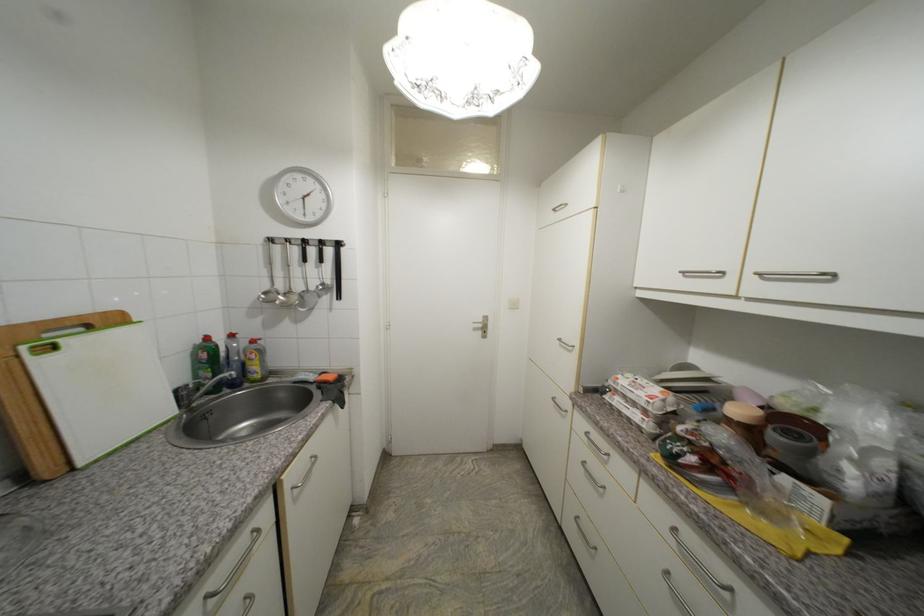
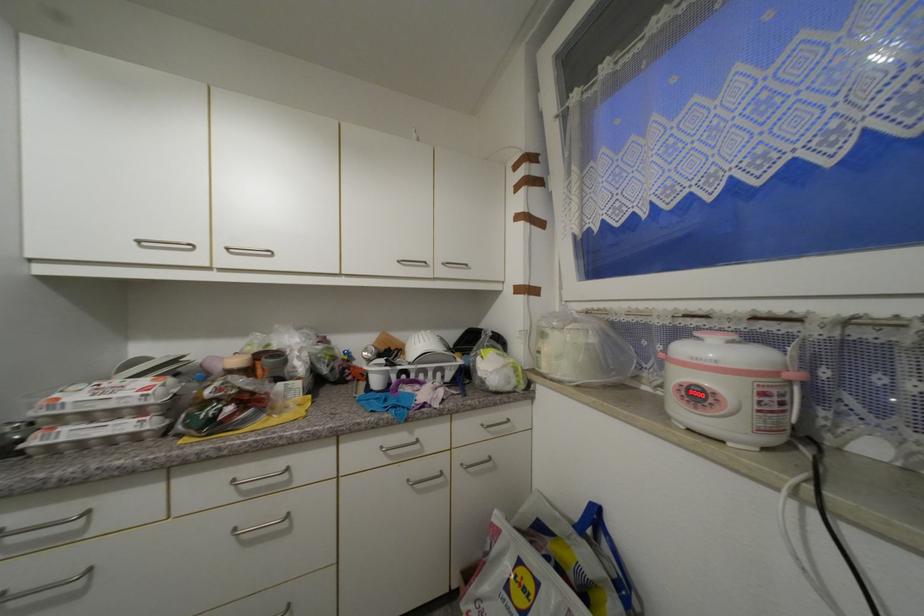
In the second image, find the point that corresponds to pixel 590 464 in the first image.

(6, 597)